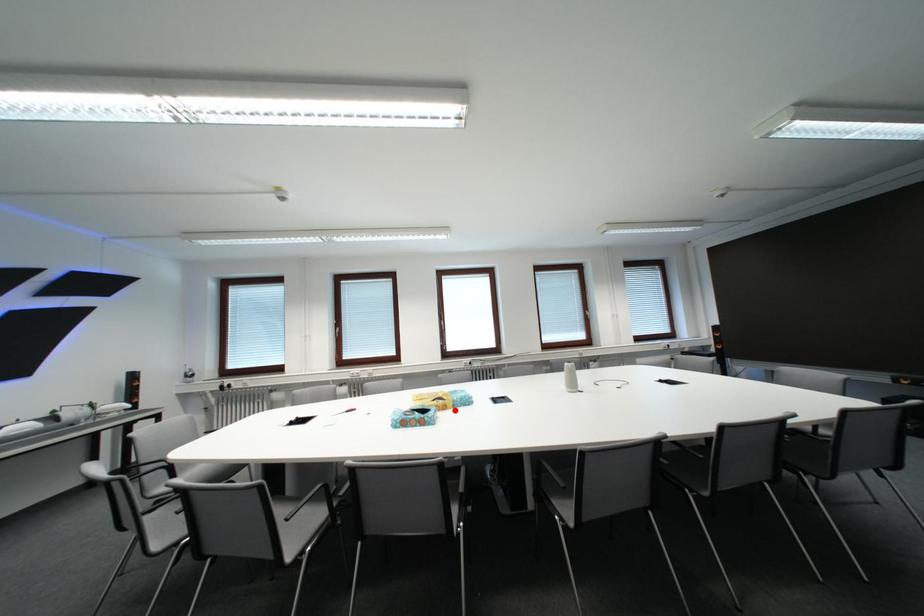
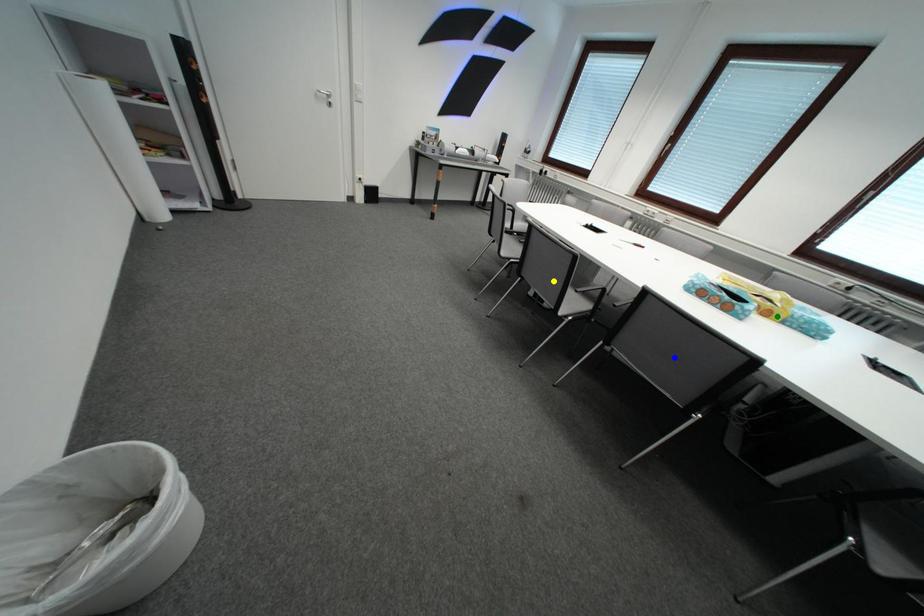
Question: I am providing you with two images of the same scene from different viewpoints. A red point is marked on the first image. You are given multiple points on the second image. Which point in image 2 represents the same 3d spot as the red point in image 1?

Choices:
 (A) green point
 (B) blue point
 (C) yellow point

Answer: (A)